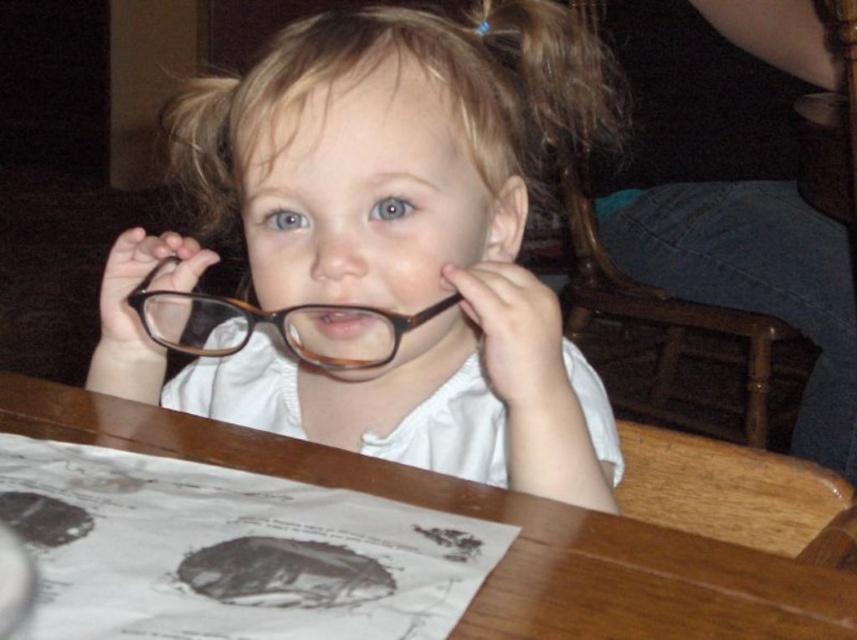
Question: Which object is farther from the camera taking this photo?

Choices:
 (A) matte brown glasses at center
 (B) brown plastic glasses at center

Answer: (B)

Question: Can you confirm if matte brown glasses at center is positioned to the right of brown plastic glasses at center?

Choices:
 (A) no
 (B) yes

Answer: (B)

Question: Which of the following is the farthest from the observer?

Choices:
 (A) (336, 92)
 (B) (519, 557)

Answer: (A)

Question: Can you confirm if matte brown glasses at center is bigger than brown plastic glasses at center?

Choices:
 (A) yes
 (B) no

Answer: (A)

Question: Does matte brown glasses at center have a smaller size compared to brown plastic glasses at center?

Choices:
 (A) yes
 (B) no

Answer: (B)

Question: Considering the real-world distances, which object is farthest from the wooden table at center?

Choices:
 (A) matte brown glasses at center
 (B) brown plastic glasses at center

Answer: (A)